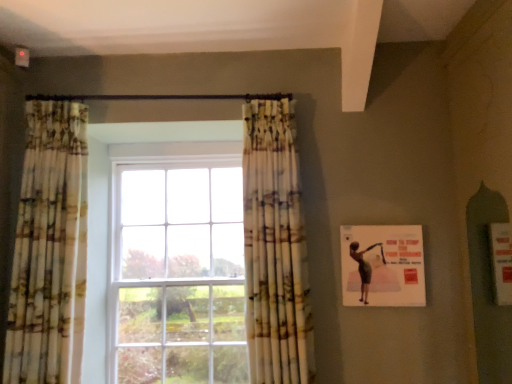
Question: Is printed fabric curtain at center, the second curtain in the left-to-right sequence, completely or partially inside matte pink poster at right?

Choices:
 (A) yes
 (B) no

Answer: (B)

Question: Can you confirm if matte pink poster at right is wider than printed fabric curtain at center, which is the 1th curtain in right-to-left order?

Choices:
 (A) no
 (B) yes

Answer: (A)

Question: Considering the relative sizes of matte pink poster at right and printed fabric curtain at center, the second curtain in the left-to-right sequence, in the image provided, is matte pink poster at right taller than printed fabric curtain at center, the second curtain in the left-to-right sequence,?

Choices:
 (A) no
 (B) yes

Answer: (A)

Question: From the image's perspective, is matte pink poster at right below printed fabric curtain at center, the second curtain in the left-to-right sequence?

Choices:
 (A) yes
 (B) no

Answer: (A)

Question: Is matte pink poster at right not inside printed fabric curtain at center, the second curtain in the left-to-right sequence?

Choices:
 (A) no
 (B) yes

Answer: (B)

Question: From a real-world perspective, is matte pink poster at right above or below printed fabric curtain at left, the 1th curtain positioned from the left?

Choices:
 (A) above
 (B) below

Answer: (B)

Question: Which is correct: matte pink poster at right is inside printed fabric curtain at left, the 1th curtain positioned from the left, or outside of it?

Choices:
 (A) outside
 (B) inside

Answer: (A)

Question: In the image, is matte pink poster at right on the left side or the right side of printed fabric curtain at left, positioned as the second curtain in right-to-left order?

Choices:
 (A) right
 (B) left

Answer: (A)

Question: Considering the positions of matte pink poster at right and printed fabric curtain at left, positioned as the second curtain in right-to-left order, in the image, is matte pink poster at right taller or shorter than printed fabric curtain at left, positioned as the second curtain in right-to-left order,?

Choices:
 (A) short
 (B) tall

Answer: (A)

Question: Is printed fabric curtain at left, the 1th curtain positioned from the left, to the left or to the right of matte pink poster at right in the image?

Choices:
 (A) left
 (B) right

Answer: (A)

Question: In terms of width, does printed fabric curtain at left, positioned as the second curtain in right-to-left order, look wider or thinner when compared to matte pink poster at right?

Choices:
 (A) thin
 (B) wide

Answer: (B)

Question: Considering the positions of printed fabric curtain at left, the 1th curtain positioned from the left, and matte pink poster at right in the image, is printed fabric curtain at left, the 1th curtain positioned from the left, taller or shorter than matte pink poster at right?

Choices:
 (A) short
 (B) tall

Answer: (B)

Question: Which is correct: printed fabric curtain at left, positioned as the second curtain in right-to-left order, is inside matte pink poster at right, or outside of it?

Choices:
 (A) inside
 (B) outside

Answer: (B)

Question: From the image's perspective, is printed fabric curtain at center, which is the 1th curtain in right-to-left order, positioned above or below printed fabric curtain at left, positioned as the second curtain in right-to-left order?

Choices:
 (A) above
 (B) below

Answer: (B)

Question: Is point (260, 289) closer or farther from the camera than point (30, 155)?

Choices:
 (A) farther
 (B) closer

Answer: (B)